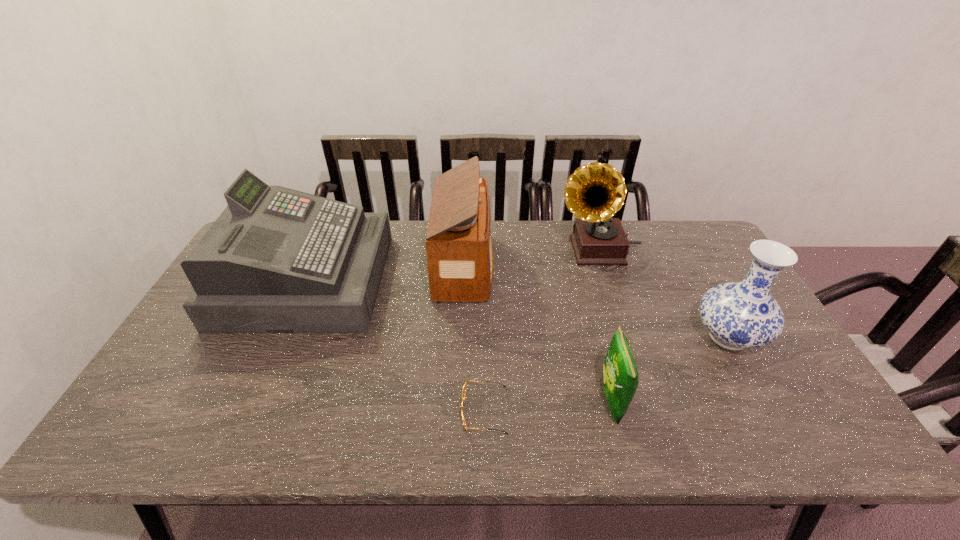
What are the coordinates of `cash register at the far edge` in the screenshot? It's located at (277, 260).

Where is `crisp (potato chip) present at the near edge`? This screenshot has width=960, height=540. crisp (potato chip) present at the near edge is located at coordinates (620, 376).

Locate an element on the screen. The height and width of the screenshot is (540, 960). spectacles present at the near edge is located at coordinates (464, 390).

Find the location of `object that is at the left edge`. object that is at the left edge is located at coordinates (277, 260).

Where is `object that is at the right edge`? The image size is (960, 540). object that is at the right edge is located at coordinates (741, 315).

Where is `object located at the far left corner`? object located at the far left corner is located at coordinates (277, 260).

Identify the location of vacant space at the far edge. (523, 260).

Locate an element on the screen. vacant area at the near edge of the desktop is located at coordinates (755, 447).

The image size is (960, 540). I want to click on vacant space at the left edge of the desktop, so click(229, 342).

Find the location of a particular element. The width and height of the screenshot is (960, 540). vacant space at the right edge of the desktop is located at coordinates (798, 378).